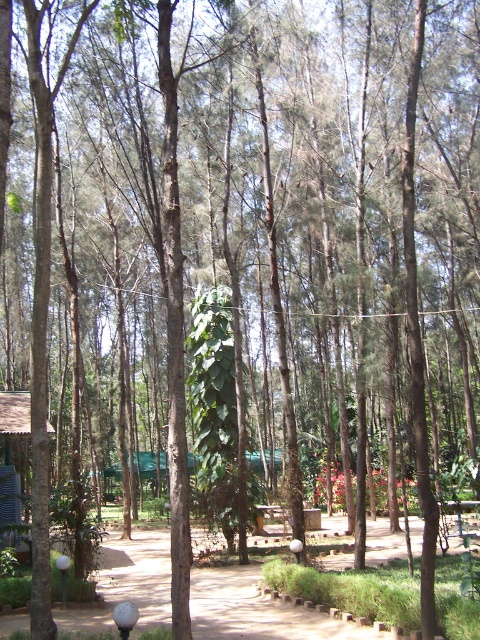
Question: Does dirt path at center have a larger size compared to wooden hut at lower left?

Choices:
 (A) yes
 (B) no

Answer: (A)

Question: Which object appears closest to the camera in this image?

Choices:
 (A) dirt path at center
 (B) wooden hut at lower left

Answer: (A)

Question: Which point appears closest to the camera in this image?

Choices:
 (A) (361, 612)
 (B) (3, 516)

Answer: (A)

Question: Can you confirm if dirt path at center is positioned to the right of wooden hut at lower left?

Choices:
 (A) no
 (B) yes

Answer: (B)

Question: Is the position of dirt path at center more distant than that of wooden hut at lower left?

Choices:
 (A) no
 (B) yes

Answer: (A)